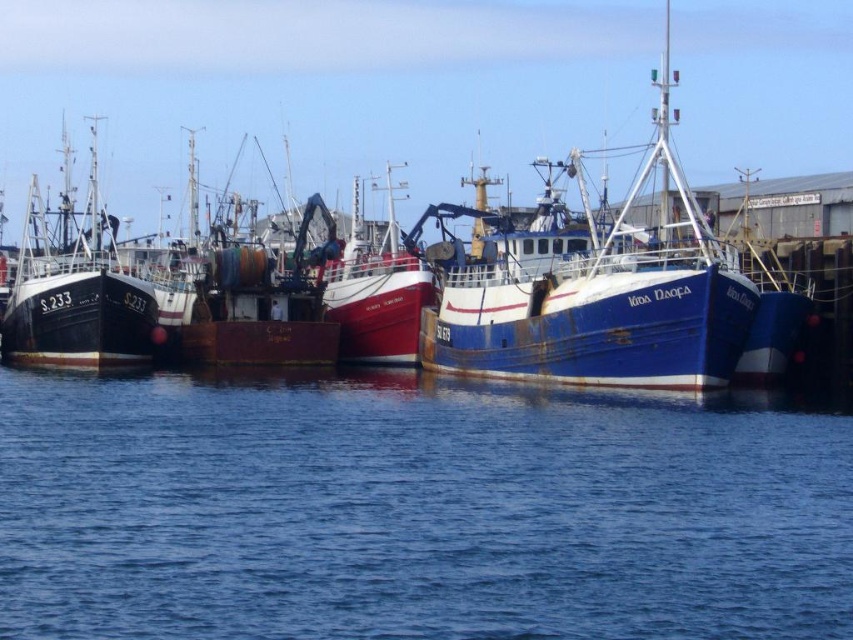
You are standing on the pier and see the blue water at center and the blue rusty boat at center. Which one is positioned to the left from your perspective?

The blue water at center is positioned to the left of the blue rusty boat at center.

Looking at this image, you are a sailor trying to navigate through the marina. You see the blue water at center and the blue rusty boat at center. Which one is located above the other?

The blue rusty boat at center is above the blue water at center because the blue water at center is positioned under it.